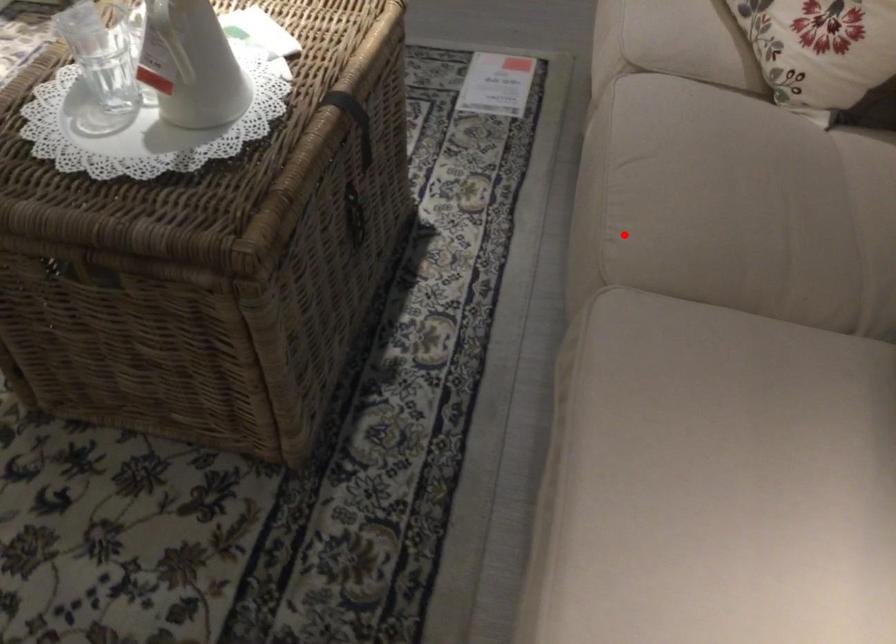
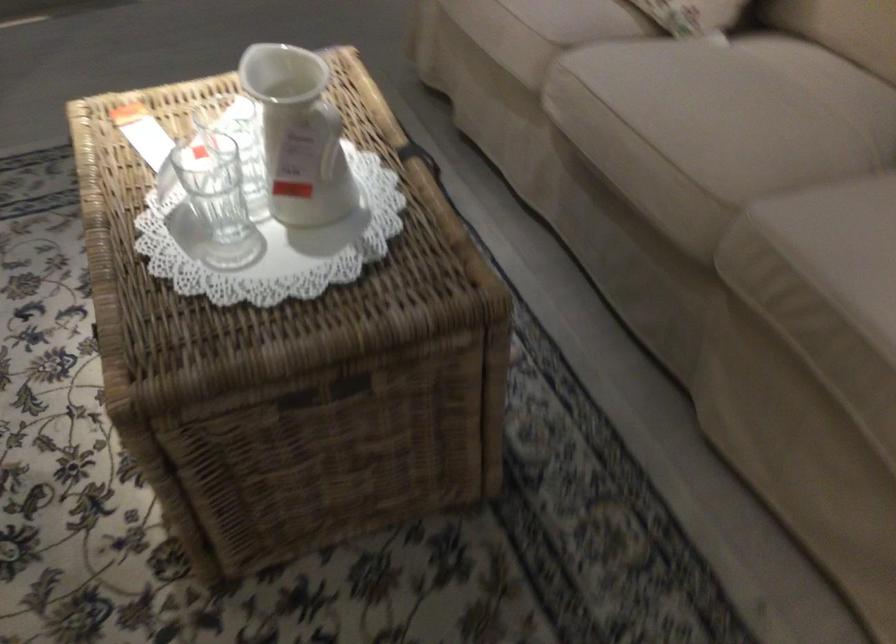
The point at the highlighted location is marked in the first image. Where is the corresponding point in the second image?

(704, 167)